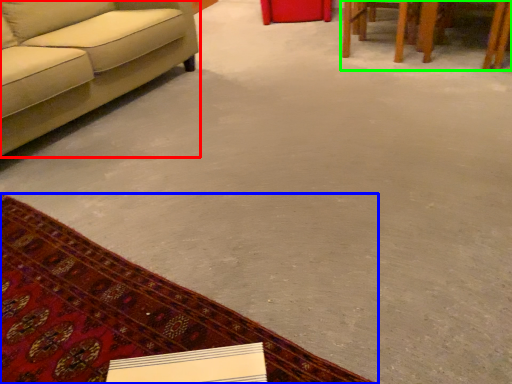
Question: Which is nearer to the studio couch (highlighted by a red box)? mat (highlighted by a blue box) or table (highlighted by a green box).

Choices:
 (A) mat
 (B) table

Answer: (A)